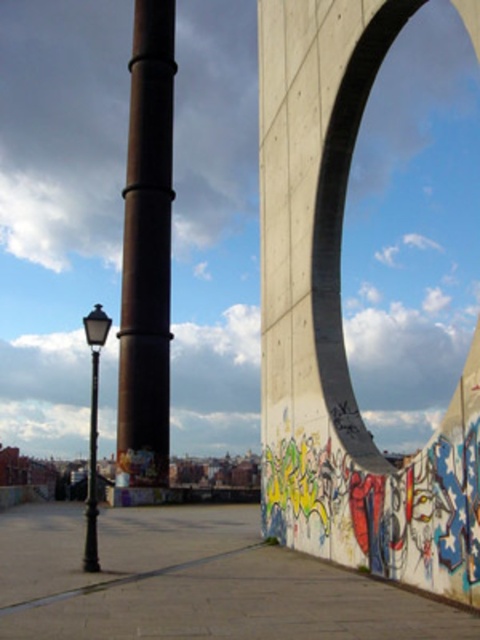
Which of these two, rusty metal pole at center or concrete/rough wall at center, stands taller?

rusty metal pole at center

Is rusty metal pole at center below concrete/rough wall at center?

No, rusty metal pole at center is not below concrete/rough wall at center.

The image size is (480, 640). Find the location of `rusty metal pole at center`. rusty metal pole at center is located at coordinates 146,252.

Find the location of a particular element. rusty metal pole at center is located at coordinates (146, 252).

Which is above, concrete/rough wall at center or polished brass streetlamp at lower left?

concrete/rough wall at center is above.

Does concrete/rough wall at center have a larger size compared to polished brass streetlamp at lower left?

No, concrete/rough wall at center is not bigger than polished brass streetlamp at lower left.

Who is more distant from viewer, (335, 257) or (95, 528)?

The point (335, 257) is behind.

Locate an element on the screen. concrete/rough wall at center is located at coordinates (344, 202).

Consider the image. Between rusty metal pole at center and polished brass streetlamp at lower left, which one is positioned lower?

polished brass streetlamp at lower left

Does rusty metal pole at center have a smaller size compared to polished brass streetlamp at lower left?

Indeed, rusty metal pole at center has a smaller size compared to polished brass streetlamp at lower left.

Is point (160, 360) behind point (96, 369)?

Yes, it is behind point (96, 369).

Identify the location of rusty metal pole at center. (146, 252).